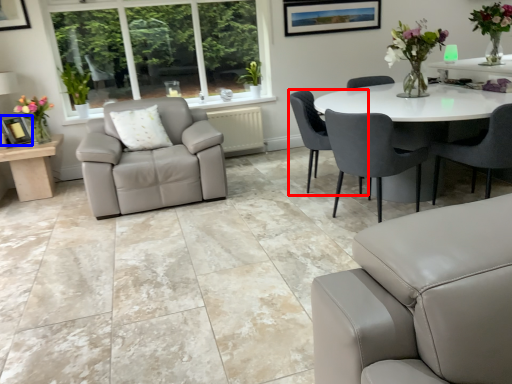
Question: Which object is closer to the camera taking this photo, chair (highlighted by a red box) or picture frame (highlighted by a blue box)?

Choices:
 (A) chair
 (B) picture frame

Answer: (A)